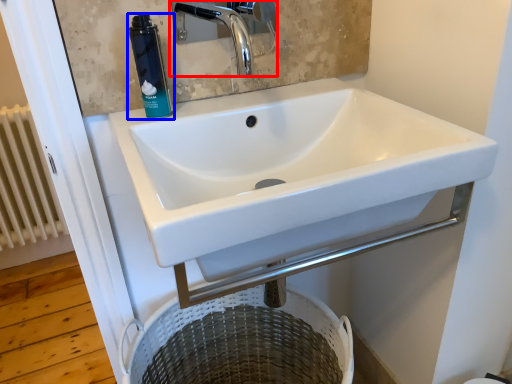
Question: Which object is closer to the camera taking this photo, tap (highlighted by a red box) or mouthwash (highlighted by a blue box)?

Choices:
 (A) tap
 (B) mouthwash

Answer: (A)